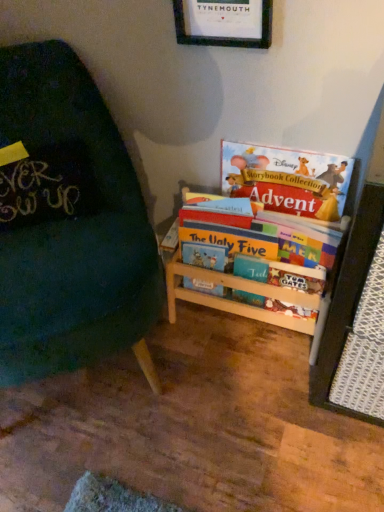
Question: Would you say wooden bookshelf at center is outside multicolored cardboard bookshelf at right, which is counted as the 2th book, starting from the top?

Choices:
 (A) yes
 (B) no

Answer: (B)

Question: Does wooden bookshelf at center touch multicolored cardboard bookshelf at right, which is counted as the 2th book, starting from the top?

Choices:
 (A) yes
 (B) no

Answer: (B)

Question: From a real-world perspective, is wooden bookshelf at center located higher than multicolored cardboard bookshelf at right, the 1th book positioned from the bottom?

Choices:
 (A) no
 (B) yes

Answer: (A)

Question: Is wooden bookshelf at center to the left of multicolored cardboard bookshelf at right, which is counted as the 2th book, starting from the top, from the viewer's perspective?

Choices:
 (A) no
 (B) yes

Answer: (A)

Question: Considering the relative sizes of wooden bookshelf at center and multicolored cardboard bookshelf at right, which is counted as the 2th book, starting from the top, in the image provided, is wooden bookshelf at center wider than multicolored cardboard bookshelf at right, which is counted as the 2th book, starting from the top,?

Choices:
 (A) yes
 (B) no

Answer: (B)

Question: Is multicolored cardboard bookshelf at right, the 1th book positioned from the bottom, at the back of wooden bookshelf at center?

Choices:
 (A) yes
 (B) no

Answer: (A)

Question: Does matte paper book at upper right, the 2th book ordered from the bottom, appear on the left side of wooden bookshelf at center?

Choices:
 (A) yes
 (B) no

Answer: (B)

Question: From the image's perspective, is matte paper book at upper right, the 2th book ordered from the bottom, under wooden bookshelf at center?

Choices:
 (A) yes
 (B) no

Answer: (B)

Question: Is matte paper book at upper right, positioned as the first book in top-to-bottom order, taller than wooden bookshelf at center?

Choices:
 (A) yes
 (B) no

Answer: (A)

Question: Is matte paper book at upper right, positioned as the first book in top-to-bottom order, at the right side of wooden bookshelf at center?

Choices:
 (A) yes
 (B) no

Answer: (A)

Question: Does matte paper book at upper right, the 2th book ordered from the bottom, turn towards wooden bookshelf at center?

Choices:
 (A) yes
 (B) no

Answer: (B)

Question: Considering the relative sizes of matte paper book at upper right, the 2th book ordered from the bottom, and wooden bookshelf at center in the image provided, is matte paper book at upper right, the 2th book ordered from the bottom, wider than wooden bookshelf at center?

Choices:
 (A) yes
 (B) no

Answer: (B)

Question: Is multicolored cardboard bookshelf at right, the 1th book positioned from the bottom, positioned beyond the bounds of wooden picture frame at upper center?

Choices:
 (A) yes
 (B) no

Answer: (A)